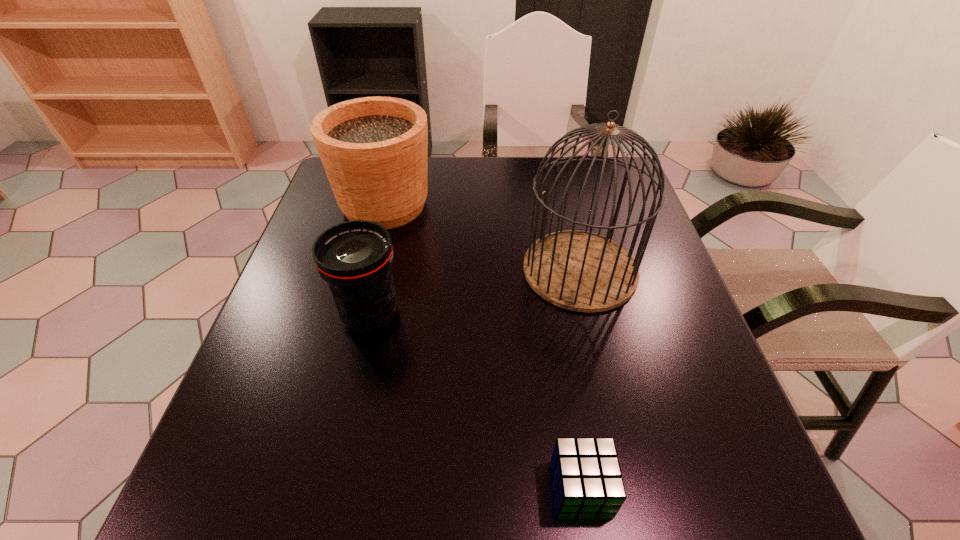
Locate an element on the screen. vacant space at the right edge of the desktop is located at coordinates (722, 447).

I want to click on vacant space at the far right corner of the desktop, so click(591, 195).

This screenshot has width=960, height=540. What are the coordinates of `free point between the tallest object and the third shortest object` in the screenshot? It's located at click(482, 237).

In order to click on vacant area that lies between the tallest object and the cube in this screenshot , I will do `click(580, 380)`.

Where is `free space between the third shortest object and the tallest object`? This screenshot has height=540, width=960. free space between the third shortest object and the tallest object is located at coordinates (482, 237).

Where is `free spot between the tallest object and the shortest object`? free spot between the tallest object and the shortest object is located at coordinates (580, 380).

Find the location of a particular element. The width and height of the screenshot is (960, 540). vacant space that is in between the birdcage and the cube is located at coordinates (580, 380).

The image size is (960, 540). I want to click on free area in between the third shortest object and the birdcage, so click(x=482, y=237).

Identify the location of free space between the birdcage and the telephoto lens. This screenshot has height=540, width=960. (475, 292).

The width and height of the screenshot is (960, 540). In order to click on vacant area that lies between the birdcage and the flowerpot in this screenshot , I will do `click(482, 237)`.